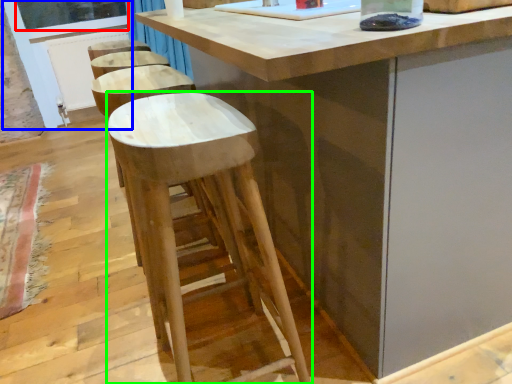
Question: Based on their relative distances, which object is farther from window screen (highlighted by a red box)? Choose from screen door (highlighted by a blue box) and stool (highlighted by a green box).

Choices:
 (A) screen door
 (B) stool

Answer: (B)